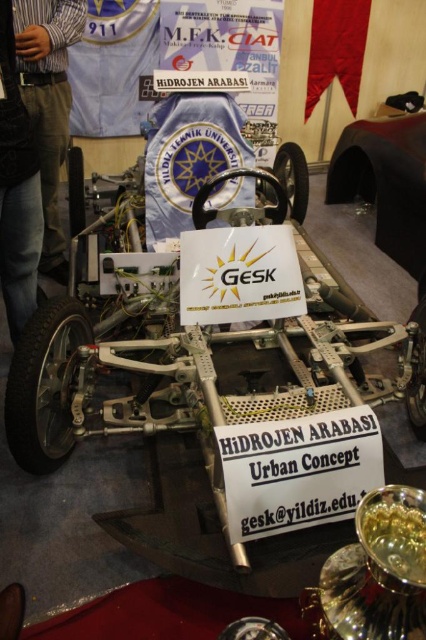
Question: Is brown denim pants at left in front of black denim jeans at left?

Choices:
 (A) no
 (B) yes

Answer: (A)

Question: In this image, where is glossy black car at center located relative to black denim jeans at left?

Choices:
 (A) above
 (B) below

Answer: (A)

Question: Which object appears closest to the camera in this image?

Choices:
 (A) black denim jeans at left
 (B) brown denim pants at left
 (C) glossy black car at center

Answer: (A)

Question: Which object is closer to the camera taking this photo?

Choices:
 (A) black denim jeans at left
 (B) glossy black car at center

Answer: (A)

Question: Which of these objects is positioned farthest from the brown denim pants at left?

Choices:
 (A) black denim jeans at left
 (B) glossy black car at center

Answer: (B)

Question: Is glossy black car at center above brown denim pants at left?

Choices:
 (A) yes
 (B) no

Answer: (A)